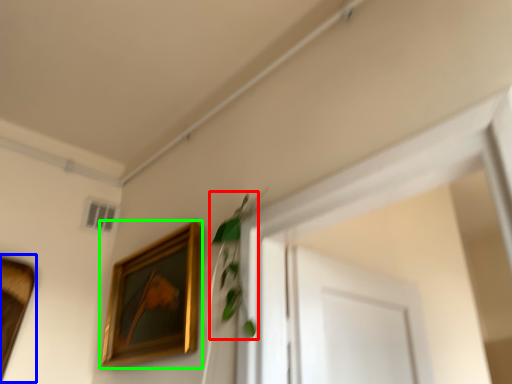
Question: Which object is positioned farthest from plant (highlighted by a red box)? Select from picture frame (highlighted by a blue box) and picture frame (highlighted by a green box).

Choices:
 (A) picture frame
 (B) picture frame

Answer: (A)